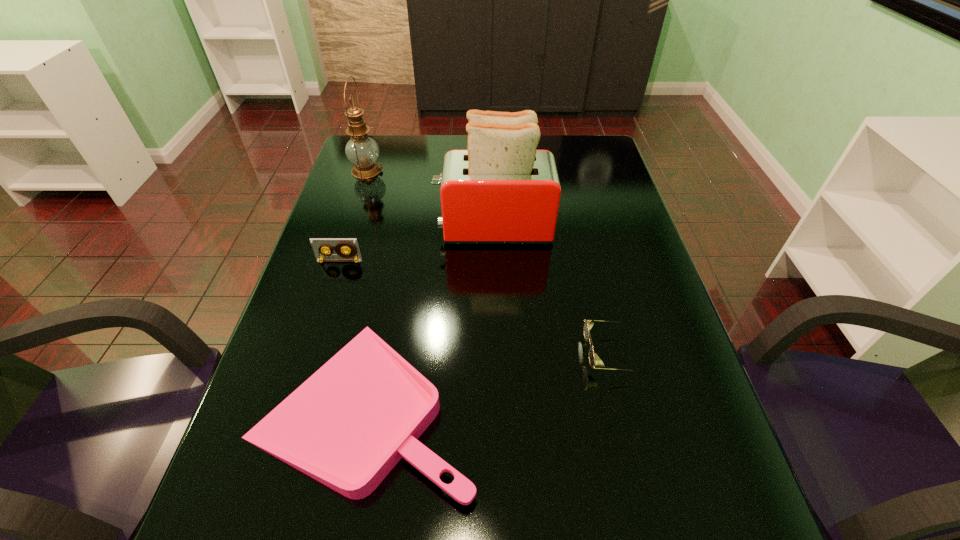
Identify the location of object that is at the far left corner. The width and height of the screenshot is (960, 540). (361, 150).

The image size is (960, 540). Find the location of `free space at the far edge of the desktop`. free space at the far edge of the desktop is located at coordinates (415, 136).

Where is `free space at the near edge of the desktop`? The image size is (960, 540). free space at the near edge of the desktop is located at coordinates (569, 534).

The width and height of the screenshot is (960, 540). In the image, there is a desktop. In order to click on vacant space at the left edge in this screenshot , I will do `click(342, 321)`.

At what (x,y) coordinates should I click in order to perform the action: click on free space at the right edge. Please return your answer as a coordinate pair (x, y). The width and height of the screenshot is (960, 540). Looking at the image, I should click on (646, 372).

This screenshot has width=960, height=540. Find the location of `vacant space at the far left corner of the desktop`. vacant space at the far left corner of the desktop is located at coordinates tap(394, 138).

Image resolution: width=960 pixels, height=540 pixels. Find the location of `vacant space at the far right corner of the desktop`. vacant space at the far right corner of the desktop is located at coordinates (597, 160).

Identify the location of blank space at the near right corner of the desktop. (707, 534).

At what (x,y) coordinates should I click in order to perform the action: click on vacant area that lies between the third farthest object and the fourth nearest object. Please return your answer as a coordinate pair (x, y). Looking at the image, I should click on (417, 244).

Identify the location of free space between the third shortest object and the toaster. (417, 244).